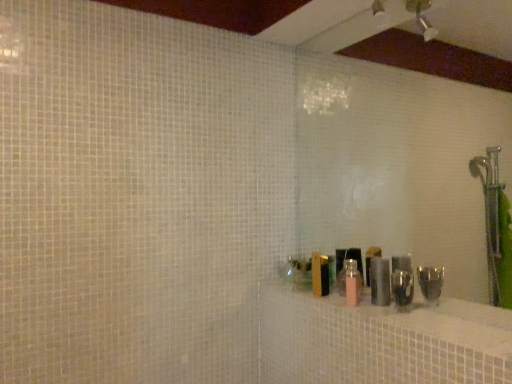
You are a GUI agent. You are given a task and a screenshot of the screen. Output one action in this format:
    pyautogui.click(x=<x>, y=<y>)
    Task: Click on the metallic silver canister at right, the 2th toiletry when ordered from left to right
    The height and width of the screenshot is (384, 512).
    Given the screenshot: What is the action you would take?
    pyautogui.click(x=380, y=281)

At what (x,y) coordinates should I click in order to perform the action: click on pink matte bottle at center, the 2th toiletry from the right. Please return your answer as a coordinate pair (x, y). The height and width of the screenshot is (384, 512). Looking at the image, I should click on (349, 258).

Considering their positions, is pink matte bottle at center located in front of or behind metallic silver canister at right, the 2th toiletry when ordered from left to right?

Visually, pink matte bottle at center is located in front of metallic silver canister at right, the 2th toiletry when ordered from left to right.

Is pink matte bottle at center inside or outside of metallic silver canister at right, the 2th toiletry when ordered from left to right?

The correct answer is: outside.

Based on the photo, considering the sizes of objects pink matte bottle at center and metallic silver canister at right, the 2th toiletry when ordered from left to right, in the image provided, who is wider, pink matte bottle at center or metallic silver canister at right, the 2th toiletry when ordered from left to right,?

With larger width is pink matte bottle at center.

How much distance is there between pink matte bottle at center and metallic silver canister at right, which is the first toiletry from right to left?

A: pink matte bottle at center and metallic silver canister at right, which is the first toiletry from right to left, are 9.89 inches apart from each other.

Where is `toiletry below the metallic silver canister at right, the 2th toiletry when ordered from left to right (from a real-world perspective)`? toiletry below the metallic silver canister at right, the 2th toiletry when ordered from left to right (from a real-world perspective) is located at coordinates (349, 258).

Between point (361, 261) and point (385, 284), which one is positioned in front?

Point (385, 284)

Considering the relative sizes of pink matte bottle at center, which is the 1th toiletry from left to right, and metallic silver canister at right, which is the first toiletry from right to left, in the image provided, is pink matte bottle at center, which is the 1th toiletry from left to right, smaller than metallic silver canister at right, which is the first toiletry from right to left,?

Actually, pink matte bottle at center, which is the 1th toiletry from left to right, might be larger than metallic silver canister at right, which is the first toiletry from right to left.

Can you tell me how much pink matte bottle at center, which is the 1th toiletry from left to right, and metallic silver canister at right, the 2th toiletry when ordered from left to right, differ in facing direction?

They differ by 0.0046 degrees in their facing directions.

Looking at their sizes, would you say metallic silver canister at right, which is the first toiletry from right to left, is wider or thinner than pink matte bottle at center?

Considering their sizes, metallic silver canister at right, which is the first toiletry from right to left, looks slimmer than pink matte bottle at center.

Looking at the image, does metallic silver canister at right, the 2th toiletry when ordered from left to right, seem bigger or smaller compared to pink matte bottle at center?

Clearly, metallic silver canister at right, the 2th toiletry when ordered from left to right, is smaller in size than pink matte bottle at center.

Choose the correct answer: Is metallic silver canister at right, the 2th toiletry when ordered from left to right, inside pink matte bottle at center or outside it?

metallic silver canister at right, the 2th toiletry when ordered from left to right, lies outside pink matte bottle at center.

Is metallic silver canister at right, the 2th toiletry when ordered from left to right, positioned with its back to pink matte bottle at center?

metallic silver canister at right, the 2th toiletry when ordered from left to right, is not turned away from pink matte bottle at center.

Is the position of pink matte bottle at center more distant than that of pink matte bottle at center, the 2th toiletry from the right?

No, it is not.

From the image's perspective, is pink matte bottle at center under pink matte bottle at center, which is the 1th toiletry from left to right?

Indeed, from the image's perspective, pink matte bottle at center is shown beneath pink matte bottle at center, which is the 1th toiletry from left to right.

Where is `toiletry on the left of pink matte bottle at center`? The image size is (512, 384). toiletry on the left of pink matte bottle at center is located at coordinates (349, 258).

Would you say pink matte bottle at center is to the left or to the right of pink matte bottle at center, which is the 1th toiletry from left to right, in the picture?

From the image, it's evident that pink matte bottle at center is to the right of pink matte bottle at center, which is the 1th toiletry from left to right.

Is metallic silver canister at right, the 2th toiletry when ordered from left to right, far from pink matte bottle at center, which is the 1th toiletry from left to right?

No, metallic silver canister at right, the 2th toiletry when ordered from left to right, is not far away from pink matte bottle at center, which is the 1th toiletry from left to right.

From the image's perspective, which is below, metallic silver canister at right, the 2th toiletry when ordered from left to right, or pink matte bottle at center, the 2th toiletry from the right?

From the image's view, pink matte bottle at center, the 2th toiletry from the right, is below.

Locate an element on the screen. Image resolution: width=512 pixels, height=384 pixels. toiletry above the pink matte bottle at center, the 2th toiletry from the right (from a real-world perspective) is located at coordinates (380, 281).

Considering the sizes of objects metallic silver canister at right, the 2th toiletry when ordered from left to right, and pink matte bottle at center, the 2th toiletry from the right, in the image provided, who is wider, metallic silver canister at right, the 2th toiletry when ordered from left to right, or pink matte bottle at center, the 2th toiletry from the right,?

With larger width is metallic silver canister at right, the 2th toiletry when ordered from left to right.

From the image's perspective, relative to pink matte bottle at center, is pink matte bottle at center, which is the 1th toiletry from left to right, above or below?

Clearly, from the image's perspective, pink matte bottle at center, which is the 1th toiletry from left to right, is above pink matte bottle at center.

Is pink matte bottle at center, the 2th toiletry from the right, positioned with its back to pink matte bottle at center?

That's not correct — pink matte bottle at center, the 2th toiletry from the right, is not looking away from pink matte bottle at center.

From the pink matte bottle at center, count 1st toiletrys backward and point to it. Please provide its 2D coordinates.

[(349, 258)]

Is pink matte bottle at center, which is the 1th toiletry from left to right, in contact with pink matte bottle at center?

No, pink matte bottle at center, which is the 1th toiletry from left to right, is not making contact with pink matte bottle at center.

The image size is (512, 384). Identify the location of toiletry to the right of pink matte bottle at center. (380, 281).

This screenshot has width=512, height=384. I want to click on toiletry lying on the left of metallic silver canister at right, the 2th toiletry when ordered from left to right, so click(x=349, y=258).

Looking at the image, which one is located further to pink matte bottle at center, metallic silver canister at right, which is the first toiletry from right to left, or pink matte bottle at center, which is the 1th toiletry from left to right?

pink matte bottle at center, which is the 1th toiletry from left to right.

Considering their positions, is pink matte bottle at center, the 2th toiletry from the right, positioned closer to pink matte bottle at center than metallic silver canister at right, which is the first toiletry from right to left?

The object closer to pink matte bottle at center is metallic silver canister at right, which is the first toiletry from right to left.

Considering their positions, is pink matte bottle at center, the 2th toiletry from the right, positioned closer to metallic silver canister at right, the 2th toiletry when ordered from left to right, than pink matte bottle at center?

Among the two, pink matte bottle at center, the 2th toiletry from the right, is located nearer to metallic silver canister at right, the 2th toiletry when ordered from left to right.

Looking at the image, which one is located closer to pink matte bottle at center, which is the 1th toiletry from left to right, pink matte bottle at center or metallic silver canister at right, the 2th toiletry when ordered from left to right?

metallic silver canister at right, the 2th toiletry when ordered from left to right.

Which object lies further to the anchor point metallic silver canister at right, which is the first toiletry from right to left, pink matte bottle at center or pink matte bottle at center, which is the 1th toiletry from left to right?

pink matte bottle at center is further to metallic silver canister at right, which is the first toiletry from right to left.

Based on their spatial positions, is metallic silver canister at right, the 2th toiletry when ordered from left to right, or pink matte bottle at center further from pink matte bottle at center, the 2th toiletry from the right?

pink matte bottle at center is positioned further to the anchor pink matte bottle at center, the 2th toiletry from the right.

Find the location of a particular element. toiletry positioned between pink matte bottle at center and metallic silver canister at right, the 2th toiletry when ordered from left to right, from near to far is located at coordinates (349, 258).